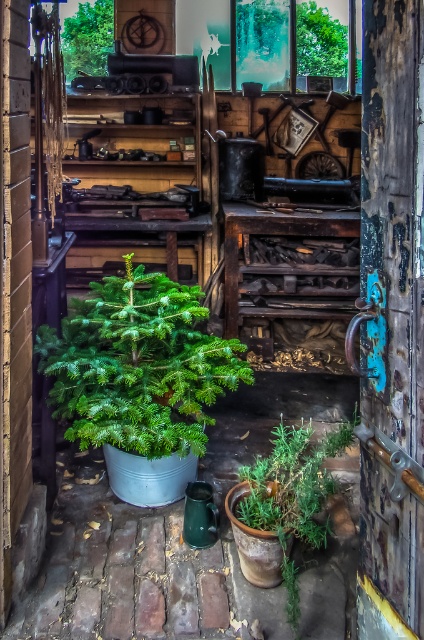
Does green matte potted plant at center appear on the right side of green leafy plant at lower center?

Incorrect, green matte potted plant at center is not on the right side of green leafy plant at lower center.

Who is shorter, green matte potted plant at center or green leafy plant at lower center?

Standing shorter between the two is green leafy plant at lower center.

Does point (94, 372) come farther from viewer compared to point (292, 580)?

That is True.

This screenshot has width=424, height=640. I want to click on green matte potted plant at center, so click(137, 365).

Which is more to the left, rusty wooden door at right or green matte potted plant at center?

green matte potted plant at center is more to the left.

Does rusty wooden door at right have a larger size compared to green matte potted plant at center?

Incorrect, rusty wooden door at right is not larger than green matte potted plant at center.

Describe the element at coordinates (392, 321) in the screenshot. I see `rusty wooden door at right` at that location.

The image size is (424, 640). Identify the location of rusty wooden door at right. (392, 321).

Can you confirm if green leafy plant at lower center is taller than green matte tree at upper center?

Indeed, green leafy plant at lower center has a greater height compared to green matte tree at upper center.

Who is shorter, green leafy plant at lower center or green matte tree at upper center?

green matte tree at upper center

Who is more distant from viewer, [290,625] or [89,3]?

Positioned behind is point [89,3].

Where is `green leafy plant at lower center`? The width and height of the screenshot is (424, 640). green leafy plant at lower center is located at coordinates (292, 493).